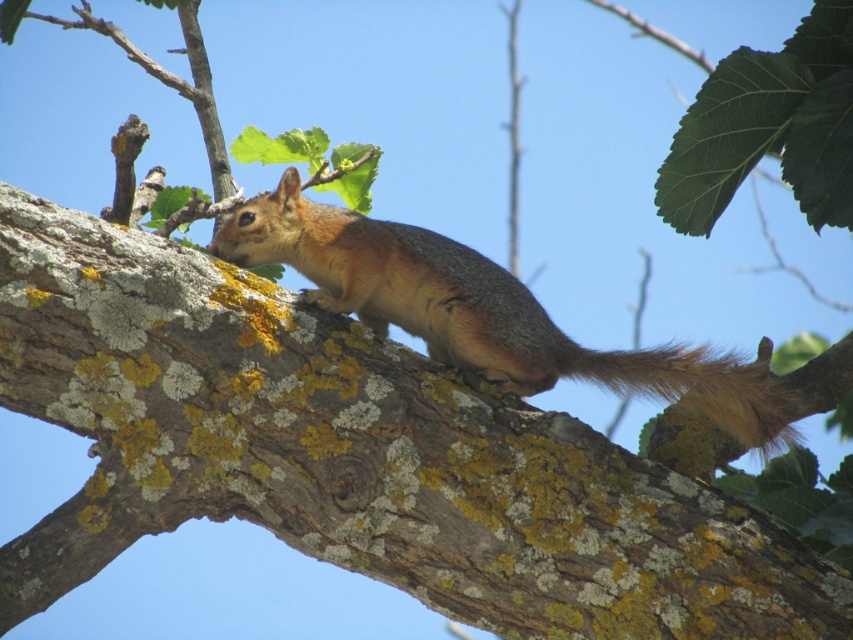
You are a wildlife photographer trying to capture the golden fur squirrel at center and the brown furry tail at right in a single frame. Based on their sizes, do you think both can fit within the camera frame without cropping?

The golden fur squirrel at center might be wider than brown furry tail at right, so it is possible that both can fit within the camera frame without cropping, but it depends on the exact dimensions of the camera frame.

You are a photographer aiming to capture the golden fur squirrel at center. Based on the scene description, where should you focus your camera to ensure the squirrel is in the frame?

The golden fur squirrel at center is located at point [483,312], so you should focus your camera at those coordinates to ensure the squirrel is centered in the frame.

You are a bird flying above the squirrel in the image. Looking down, you notice the golden fur squirrel at center and the brown furry tail at right. Which of these two is positioned higher from your viewpoint?

The golden fur squirrel at center is positioned higher than the brown furry tail at right from your viewpoint because the squirrel is above the tail in the image.